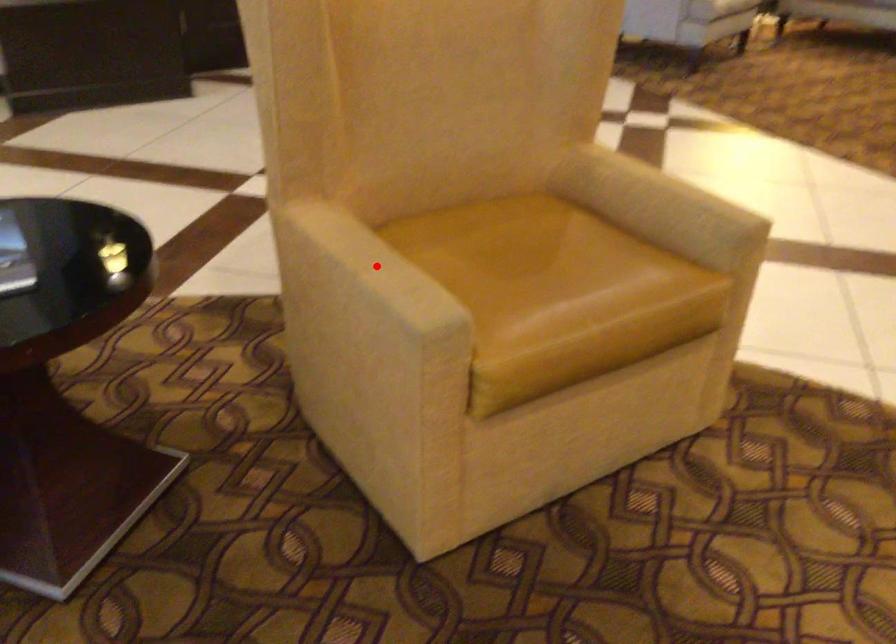
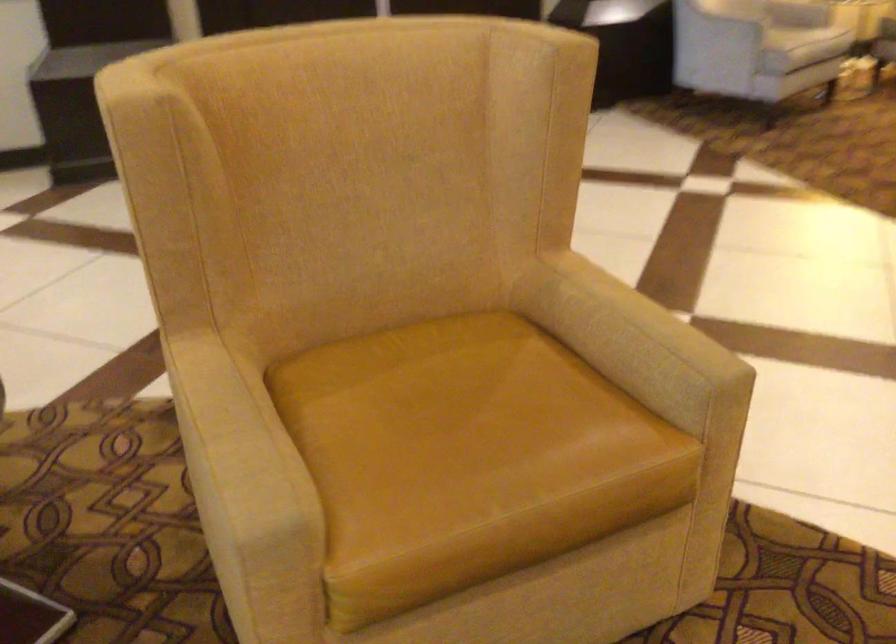
Question: I am providing you with two images of the same scene from different viewpoints. A red point is shown in image1. For the corresponding object point in image2, is it positioned nearer or farther from the camera?

Choices:
 (A) Nearer
 (B) Farther

Answer: (A)